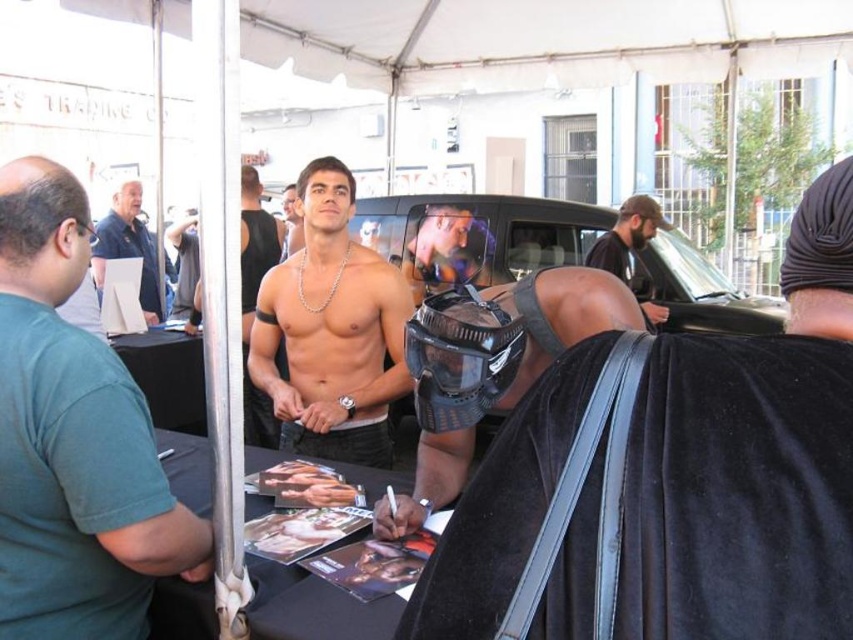
You are a photographer at the event and need to capture a clear photo of the shiny silver chain at center and the bearded man at center. Based on their positions, which object is closer to the bottom edge of the photo?

The shiny silver chain at center is closer to the bottom edge of the photo because it is positioned below the bearded man at center.